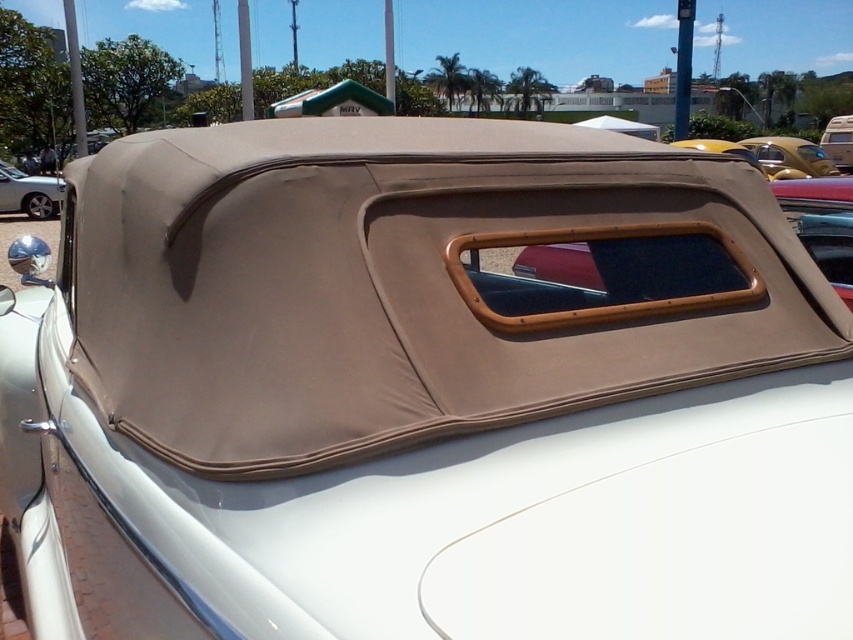
You are a mechanic working on a vintage car. You need to replace the beige fabric convertible top at center and the beige fabric car at center. Which object should you work on first if you want to start from the left side of the car?

The beige fabric convertible top at center should be worked on first because it is positioned to the left of the beige fabric car at center.